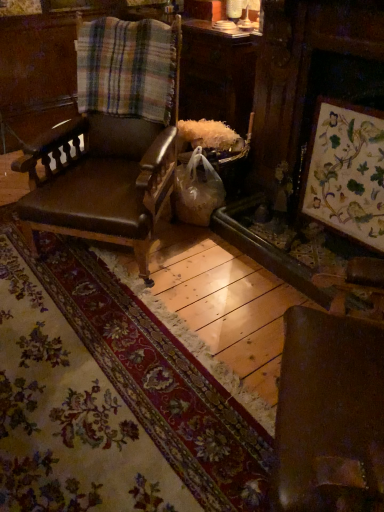
Question: Can you see plaid fabric at upper left touching wooden floral artwork at right?

Choices:
 (A) yes
 (B) no

Answer: (B)

Question: From a real-world perspective, is plaid fabric at upper left physically below wooden floral artwork at right?

Choices:
 (A) no
 (B) yes

Answer: (A)

Question: Can you confirm if plaid fabric at upper left is taller than wooden floral artwork at right?

Choices:
 (A) no
 (B) yes

Answer: (A)

Question: Considering the relative sizes of plaid fabric at upper left and wooden floral artwork at right in the image provided, is plaid fabric at upper left wider than wooden floral artwork at right?

Choices:
 (A) no
 (B) yes

Answer: (B)

Question: From the image's perspective, is plaid fabric at upper left on top of wooden floral artwork at right?

Choices:
 (A) no
 (B) yes

Answer: (B)

Question: Is plaid fabric at upper left far from wooden floral artwork at right?

Choices:
 (A) no
 (B) yes

Answer: (A)

Question: Is there a large distance between plaid fabric at upper left and brown leather chair at center?

Choices:
 (A) no
 (B) yes

Answer: (A)

Question: Does plaid fabric at upper left lie behind brown leather chair at center?

Choices:
 (A) no
 (B) yes

Answer: (B)

Question: Could you tell me if plaid fabric at upper left is facing brown leather chair at center?

Choices:
 (A) yes
 (B) no

Answer: (A)

Question: Is plaid fabric at upper left smaller than brown leather chair at center?

Choices:
 (A) yes
 (B) no

Answer: (A)

Question: Is the position of plaid fabric at upper left less distant than that of brown leather chair at center?

Choices:
 (A) no
 (B) yes

Answer: (A)

Question: Does plaid fabric at upper left contain brown leather chair at center?

Choices:
 (A) no
 (B) yes

Answer: (A)

Question: Is wooden floral artwork at right touching brown leather chair at center?

Choices:
 (A) no
 (B) yes

Answer: (A)